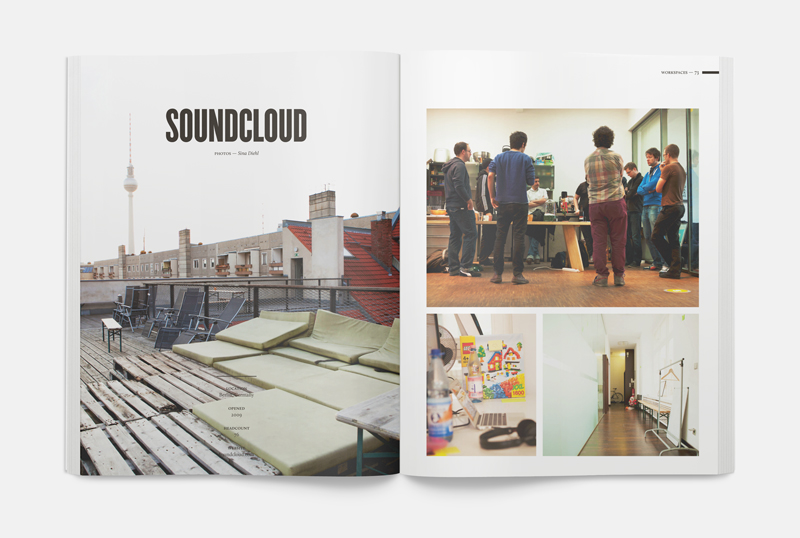
Identify the location of wall. The image size is (800, 538). (200, 257).